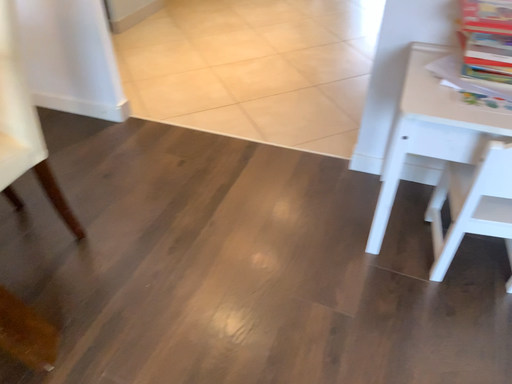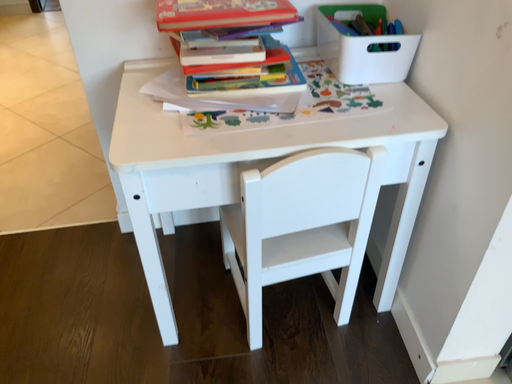
Question: How did the camera likely rotate when shooting the video?

Choices:
 (A) rotated downward
 (B) rotated upward

Answer: (B)